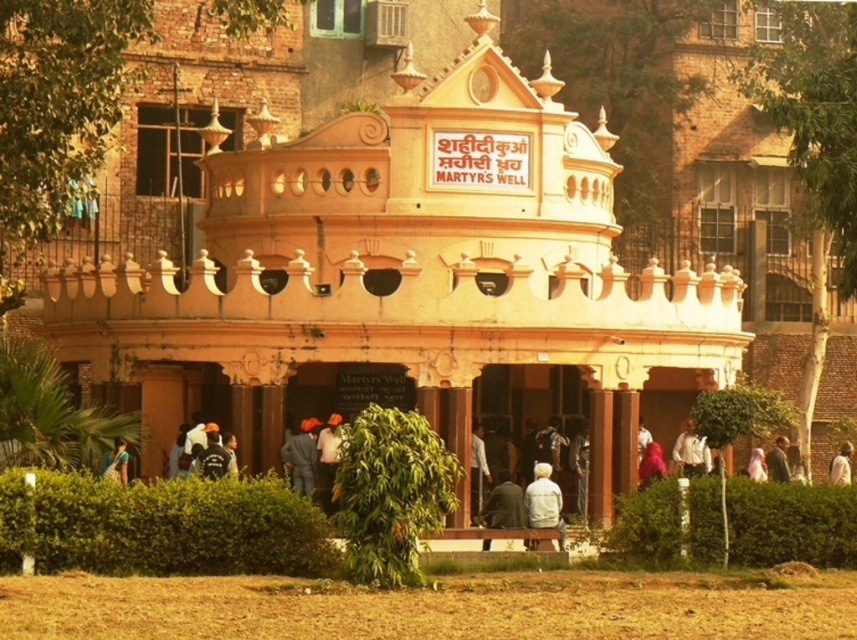
You are standing at the entrance of the MARTYRS WELL and want to greet both the person wearing the dark gray fabric jacket at center and the person in the green fabric dress at lower left. Which person should you approach first if you want to minimize the total distance walked?

The dark gray fabric jacket at center is 12.32 meters away from the green fabric dress at lower left. To minimize the total distance walked, you should approach one person first and then the other, but since the distance between them is fixed, the order doesn not matter. However, if you start at the entrance, you would need to know which is closer to you. Since the scene description doesn mention their distance from the entrance, it is impossible to determine the optimal path based solely on the given data.

You are standing in front of the MARTYRS WELL and notice two fabrics. The black fabric at lower center and the pink fabric at center. Which fabric is positioned higher from the ground?

The black fabric at lower center is above the pink fabric at center, so it is positioned higher from the ground.